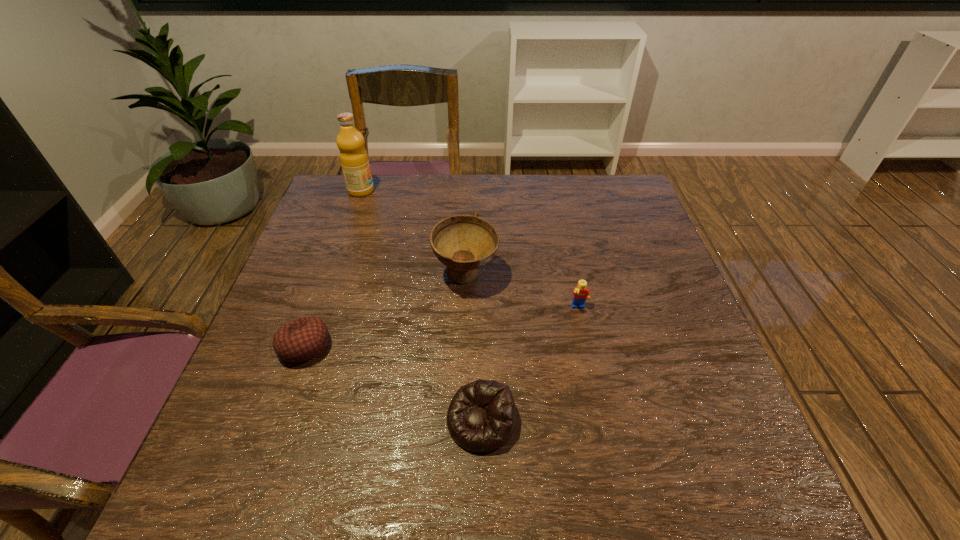
Find the location of a particular element. This screenshot has height=540, width=960. vacant area between the soup bowl and the fourth farthest object is located at coordinates (385, 311).

I want to click on vacant space that is in between the farther beanbag and the farthest object, so click(333, 268).

Locate which object is the third closest to the nearer beanbag. Please provide its 2D coordinates. Your answer should be formatted as a tuple, i.e. [(x, y)], where the tuple contains the x and y coordinates of a point satisfying the conditions above.

[(303, 339)]

Identify the location of object that stands as the third closest to the nearer beanbag. This screenshot has height=540, width=960. (303, 339).

Identify the location of vacant space that satisfies the following two spatial constraints: 1. on the front side of the nearest object; 2. on the right side of the soup bowl. (461, 421).

The image size is (960, 540). Find the location of `free spot that satisfies the following two spatial constraints: 1. on the front label of the nearer beanbag; 2. on the left side of the fruit juice`. free spot that satisfies the following two spatial constraints: 1. on the front label of the nearer beanbag; 2. on the left side of the fruit juice is located at coordinates (280, 421).

Find the location of a particular element. free space that satisfies the following two spatial constraints: 1. on the front label of the nearer beanbag; 2. on the left side of the farthest object is located at coordinates pos(280,421).

Where is `free spot that satisfies the following two spatial constraints: 1. on the front label of the soup bowl; 2. on the right side of the tallest object`? Image resolution: width=960 pixels, height=540 pixels. free spot that satisfies the following two spatial constraints: 1. on the front label of the soup bowl; 2. on the right side of the tallest object is located at coordinates (331, 276).

Where is `free space that satisfies the following two spatial constraints: 1. on the front label of the fruit juice; 2. on the left side of the right beanbag`? Image resolution: width=960 pixels, height=540 pixels. free space that satisfies the following two spatial constraints: 1. on the front label of the fruit juice; 2. on the left side of the right beanbag is located at coordinates (280, 421).